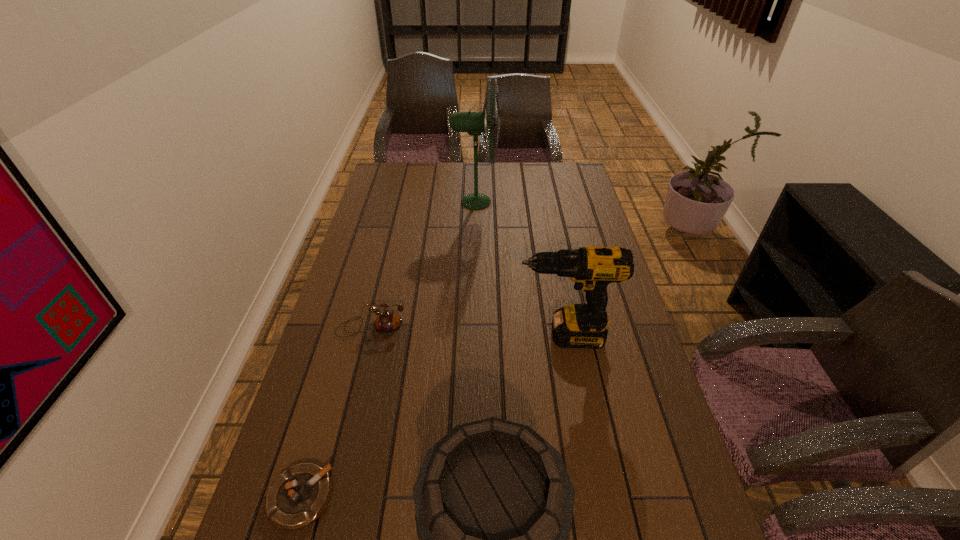
You are a GUI agent. You are given a task and a screenshot of the screen. Output one action in this format:
    pyautogui.click(x=<x>, y=<y>)
    Task: Click on the free space between the drill and the farthest object
    
    Given the screenshot: What is the action you would take?
    pyautogui.click(x=519, y=269)

You are a GUI agent. You are given a task and a screenshot of the screen. Output one action in this format:
    pyautogui.click(x=<x>, y=<y>)
    Task: Click on the empty space between the fan and the second shortest object
    The width and height of the screenshot is (960, 540).
    Given the screenshot: What is the action you would take?
    pyautogui.click(x=423, y=265)

Locate an element on the screen. empty location between the drill and the ashtray is located at coordinates (432, 416).

The height and width of the screenshot is (540, 960). Find the location of `empty space between the drill and the tallest object`. empty space between the drill and the tallest object is located at coordinates (519, 269).

Identify the location of free spot between the telephone and the farthest object. (423, 265).

At what (x,y) coordinates should I click in order to perform the action: click on blank region between the fan and the ashtray. Please return your answer as a coordinate pair (x, y). Looking at the image, I should click on (x=388, y=349).

Identify the location of the closest object to the shortest object. (494, 502).

Locate an element on the screen. object that is the closest one to the shortest object is located at coordinates (494, 502).

At what (x,y) coordinates should I click in order to perform the action: click on vacant position in the image that satisfies the following two spatial constraints: 1. on the front-facing side of the fan; 2. on the rotary dial of the telephone. Please return your answer as a coordinate pair (x, y). Looking at the image, I should click on (473, 327).

The height and width of the screenshot is (540, 960). I want to click on vacant space that satisfies the following two spatial constraints: 1. on the front-facing side of the fan; 2. on the rotary dial of the telephone, so click(473, 327).